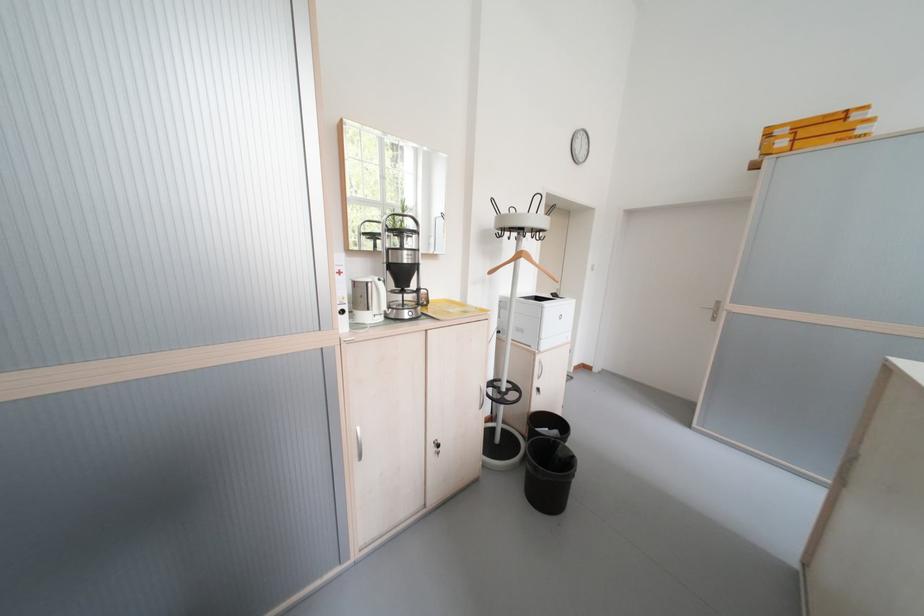
Find where to pull the silver door handle. Please return your answer as a coordinate pair (x, y).

(359, 443)